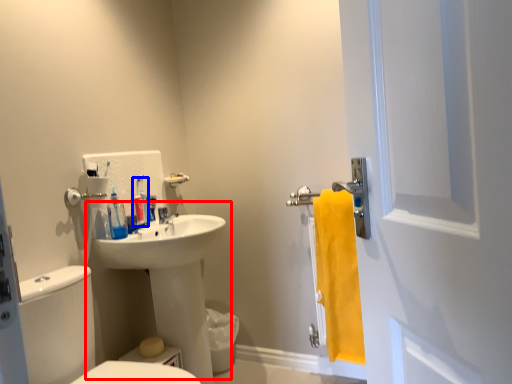
Question: Which of the following is the closest to the observer, sink (highlighted by a red box) or toiletry (highlighted by a blue box)?

Choices:
 (A) sink
 (B) toiletry

Answer: (A)